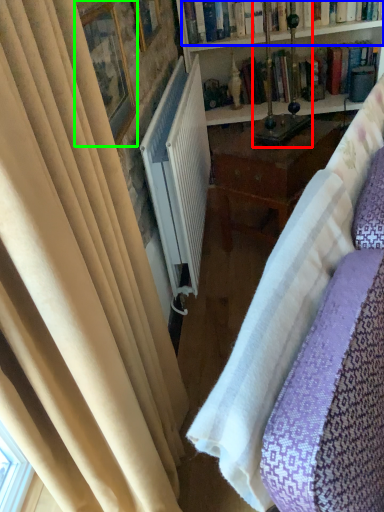
Question: Considering the real-world distances, which object is farthest from table lamp (highlighted by a red box)? book (highlighted by a blue box) or picture frame (highlighted by a green box)?

Choices:
 (A) book
 (B) picture frame

Answer: (B)